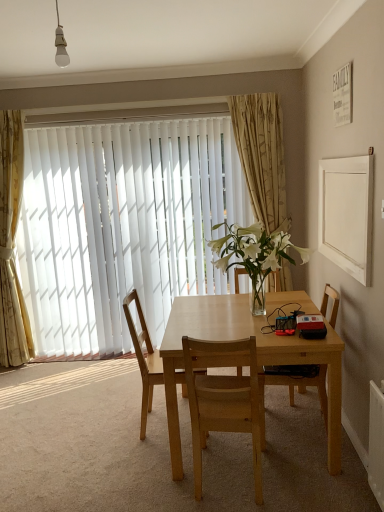
Describe the element at coordinates (12, 245) in the screenshot. The image size is (384, 512). I see `gold textured curtain at left, which is the first curtain in left-to-right order` at that location.

What do you see at coordinates (144, 357) in the screenshot? The image size is (384, 512). I see `light wood chair at center, placed as the 3th chair when sorted from right to left` at bounding box center [144, 357].

This screenshot has height=512, width=384. Find the location of `light wood chair at center, the first chair when ordered from left to right`. light wood chair at center, the first chair when ordered from left to right is located at coordinates (144, 357).

In order to face white matte frame at upper right, should I rotate leftwards or rightwards?

Turn right by 19.322 degrees to look at white matte frame at upper right.

Consider the image. What is the approximate height of wooden chair at right, which is the first chair from right to left?

It is 35.03 inches.

Identify the location of light wood table at center. Image resolution: width=384 pixels, height=512 pixels. coord(257,358).

Where is `gold textured curtain at left, the 2th curtain in the right-to-left sequence`? The height and width of the screenshot is (512, 384). gold textured curtain at left, the 2th curtain in the right-to-left sequence is located at coordinates (12, 245).

From the picture: Between white matte frame at upper right and light wood chair at center, the first chair when ordered from left to right, which one has larger width?

light wood chair at center, the first chair when ordered from left to right, is wider.

Is point (370, 206) behind point (138, 298)?

No, it is in front of (138, 298).

Consider the image. Is light wood chair at center, the first chair when ordered from left to right, at the back of white matte frame at upper right?

white matte frame at upper right is not turned away from light wood chair at center, the first chair when ordered from left to right.

Considering the sizes of white matte frame at upper right and light wood chair at center, the first chair when ordered from left to right, in the image, is white matte frame at upper right bigger or smaller than light wood chair at center, the first chair when ordered from left to right,?

In the image, white matte frame at upper right appears to be smaller than light wood chair at center, the first chair when ordered from left to right.

Is light wood chair at center, the first chair when ordered from left to right, positioned with its back to clear glass vase at center?

No.

Considering the relative sizes of light wood chair at center, the first chair when ordered from left to right, and clear glass vase at center in the image provided, is light wood chair at center, the first chair when ordered from left to right, taller than clear glass vase at center?

Yes.

Is light wood chair at center, the first chair when ordered from left to right, at the right side of clear glass vase at center?

In fact, light wood chair at center, the first chair when ordered from left to right, is to the left of clear glass vase at center.

Is gold textured curtain at left, which is the first curtain in left-to-right order, not inside light brown wood chair at center, the second chair from the left?

That's correct, gold textured curtain at left, which is the first curtain in left-to-right order, is outside of light brown wood chair at center, the second chair from the left.

Are gold textured curtain at left, which is the first curtain in left-to-right order, and light brown wood chair at center, placed as the 2th chair when sorted from right to left, located far from each other?

That's right, there is a large distance between gold textured curtain at left, which is the first curtain in left-to-right order, and light brown wood chair at center, placed as the 2th chair when sorted from right to left.

From a real-world perspective, between gold textured curtain at left, which is the first curtain in left-to-right order, and light brown wood chair at center, placed as the 2th chair when sorted from right to left, who is vertically lower?

light brown wood chair at center, placed as the 2th chair when sorted from right to left.

This screenshot has width=384, height=512. What are the coordinates of `curtain to the left of light brown wood chair at center, placed as the 2th chair when sorted from right to left` in the screenshot? It's located at (12, 245).

Who is shorter, white vertical blinds at center or clear glass vase at center?

clear glass vase at center is shorter.

Where is `window positioned vertically above the clear glass vase at center (from a real-world perspective)`? window positioned vertically above the clear glass vase at center (from a real-world perspective) is located at coordinates (122, 226).

Considering the relative positions of white vertical blinds at center and clear glass vase at center in the image provided, is white vertical blinds at center behind clear glass vase at center?

Yes, the depth of white vertical blinds at center is greater than that of clear glass vase at center.

From a real-world perspective, is light brown wood chair at center, placed as the 2th chair when sorted from right to left, positioned above or below white vertical blinds at center?

From a real-world perspective, light brown wood chair at center, placed as the 2th chair when sorted from right to left, is physically below white vertical blinds at center.

Consider the image. Is light brown wood chair at center, the second chair from the left, wider than white vertical blinds at center?

Yes.

Between light brown wood chair at center, the second chair from the left, and white vertical blinds at center, which one has larger size?

With larger size is white vertical blinds at center.

Is point (211, 331) less distant than point (185, 350)?

No, it is not.

Can we say light wood table at center lies outside light brown wood chair at center, the second chair from the left?

light wood table at center is positioned outside light brown wood chair at center, the second chair from the left.

From the picture: From a real-world perspective, which is physically below, light wood table at center or light brown wood chair at center, the second chair from the left?

light wood table at center.

Does light wood table at center come behind light brown wood chair at center, the second chair from the left?

Yes, the depth of light wood table at center is greater than that of light brown wood chair at center, the second chair from the left.

Considering the positions of objects clear glass vase at center and light wood chair at center, the first chair when ordered from left to right, in the image provided, who is more to the left, clear glass vase at center or light wood chair at center, the first chair when ordered from left to right,?

light wood chair at center, the first chair when ordered from left to right, is more to the left.

Consider the image. Is clear glass vase at center not near light wood chair at center, the first chair when ordered from left to right?

clear glass vase at center is near light wood chair at center, the first chair when ordered from left to right, not far away.

Where is `flower above the light wood chair at center, the first chair when ordered from left to right (from a real-world perspective)`? flower above the light wood chair at center, the first chair when ordered from left to right (from a real-world perspective) is located at coordinates point(254,251).

From a real-world perspective, is clear glass vase at center positioned over light wood chair at center, the first chair when ordered from left to right, based on gravity?

Yes, from a real-world perspective, clear glass vase at center is above light wood chair at center, the first chair when ordered from left to right.

Image resolution: width=384 pixels, height=512 pixels. I want to click on the 2nd chair below the white matte frame at upper right (from the image's perspective), so click(x=144, y=357).

Where is `chair that is the 2nd object located behind the clear glass vase at center`? Image resolution: width=384 pixels, height=512 pixels. chair that is the 2nd object located behind the clear glass vase at center is located at coordinates (144, 357).

Estimate the real-world distances between objects in this image. Which object is closer to light wood chair at center, placed as the 3th chair when sorted from right to left, beige floral fabric curtain at upper center, marked as the first curtain in a right-to-left arrangement, or wooden chair at right, which appears as the 3th chair when viewed from the left?

wooden chair at right, which appears as the 3th chair when viewed from the left, is positioned closer to the anchor light wood chair at center, placed as the 3th chair when sorted from right to left.

Looking at the image, which one is located further to light wood chair at center, the first chair when ordered from left to right, wooden chair at right, which is the first chair from right to left, or white vertical blinds at center?

white vertical blinds at center is positioned further to the anchor light wood chair at center, the first chair when ordered from left to right.

From the image, which object appears to be nearer to wooden chair at right, which appears as the 3th chair when viewed from the left, gold textured curtain at left, which is the first curtain in left-to-right order, or clear glass vase at center?

clear glass vase at center is positioned closer to the anchor wooden chair at right, which appears as the 3th chair when viewed from the left.

In the scene shown: Based on their spatial positions, is gold textured curtain at left, which is the first curtain in left-to-right order, or light wood chair at center, placed as the 3th chair when sorted from right to left, further from clear glass vase at center?

The object further to clear glass vase at center is gold textured curtain at left, which is the first curtain in left-to-right order.

In the scene shown: From the image, which object appears to be farther from light wood chair at center, the first chair when ordered from left to right, clear glass vase at center or white vertical blinds at center?

white vertical blinds at center is positioned further to the anchor light wood chair at center, the first chair when ordered from left to right.

Looking at the image, which one is located further to white matte frame at upper right, light wood chair at center, placed as the 3th chair when sorted from right to left, or wooden chair at right, which is the first chair from right to left?

Among the two, light wood chair at center, placed as the 3th chair when sorted from right to left, is located further to white matte frame at upper right.

Considering their positions, is white matte frame at upper right positioned closer to gold textured curtain at left, which is the first curtain in left-to-right order, than beige floral fabric curtain at upper center, which is counted as the 2th curtain, starting from the left?

Among the two, beige floral fabric curtain at upper center, which is counted as the 2th curtain, starting from the left, is located nearer to gold textured curtain at left, which is the first curtain in left-to-right order.

Based on their spatial positions, is light wood table at center or white vertical blinds at center further from gold textured curtain at left, the 2th curtain in the right-to-left sequence?

light wood table at center is positioned further to the anchor gold textured curtain at left, the 2th curtain in the right-to-left sequence.

Where is `desk located between gold textured curtain at left, which is the first curtain in left-to-right order, and clear glass vase at center in the left-right direction`? Image resolution: width=384 pixels, height=512 pixels. desk located between gold textured curtain at left, which is the first curtain in left-to-right order, and clear glass vase at center in the left-right direction is located at coordinates (257, 358).

At what (x,y) coordinates should I click in order to perform the action: click on flower between white matte frame at upper right and light wood table at center in the vertical direction. Please return your answer as a coordinate pair (x, y). Looking at the image, I should click on (254, 251).

You are a GUI agent. You are given a task and a screenshot of the screen. Output one action in this format:
    pyautogui.click(x=<x>, y=<y>)
    Task: Click on the flower between white matte frame at upper right and white vertical blinds at center in the front-back direction
    The image size is (384, 512).
    Given the screenshot: What is the action you would take?
    pyautogui.click(x=254, y=251)

Locate an element on the screen. The image size is (384, 512). flower between beige floral fabric curtain at upper center, which is counted as the 2th curtain, starting from the left, and light wood table at center, in the vertical direction is located at coordinates (254, 251).